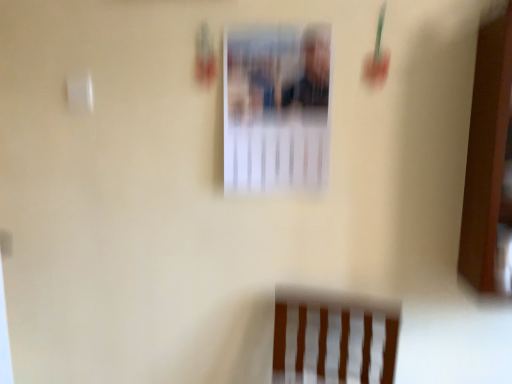
Measure the distance between point (296, 158) and camera.

A distance of 4.14 feet exists between point (296, 158) and camera.

Locate an element on the screen. This screenshot has width=512, height=384. matte paper poster at center is located at coordinates (277, 107).

Describe the element at coordinates (277, 107) in the screenshot. I see `matte paper poster at center` at that location.

This screenshot has height=384, width=512. What are the coordinates of `matte paper poster at center` in the screenshot? It's located at (277, 107).